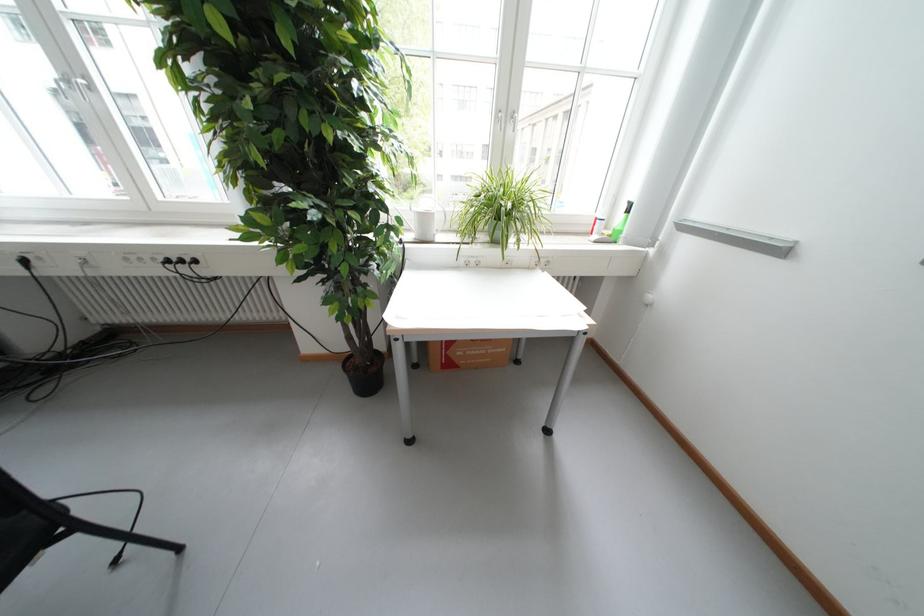
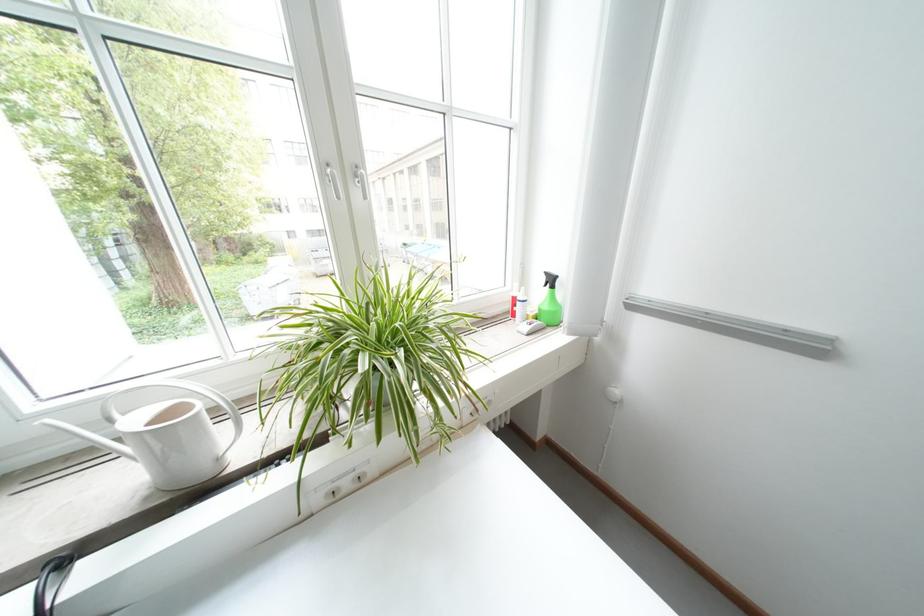
In the second image, find the point that corresponds to point (523, 120) in the first image.

(367, 177)